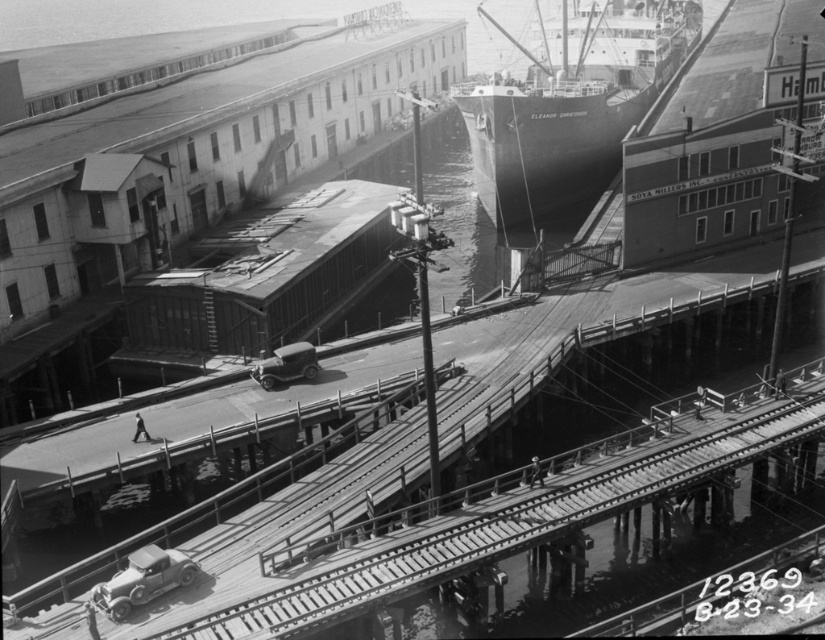
Find the location of `dark gray matte ship at upper center`. dark gray matte ship at upper center is located at coordinates (571, 104).

Can you confirm if dark gray matte ship at upper center is positioned to the left of shiny silver car at center?

No, dark gray matte ship at upper center is not to the left of shiny silver car at center.

Find the location of a particular element. dark gray matte ship at upper center is located at coordinates (571, 104).

Is smooth wooden planks at center above shiny silver car at center?

No, smooth wooden planks at center is not above shiny silver car at center.

Is point (258, 627) in front of point (277, 381)?

That is True.

This screenshot has width=825, height=640. Identify the location of smooth wooden planks at center. (510, 512).

Does shiny silver car at lower left have a greater height compared to shiny silver car at center?

Yes, shiny silver car at lower left is taller than shiny silver car at center.

Which is below, shiny silver car at lower left or shiny silver car at center?

shiny silver car at lower left is below.

Is point (140, 547) closer to camera compared to point (297, 369)?

Yes, point (140, 547) is closer to viewer.

Where is `shiny silver car at lower left`? Image resolution: width=825 pixels, height=640 pixels. shiny silver car at lower left is located at coordinates (142, 580).